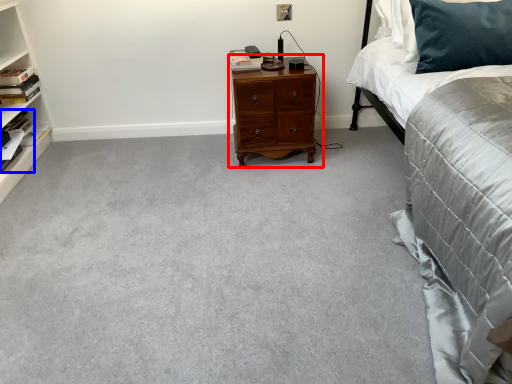
Question: Which of the following is the farthest to the observer, nightstand (highlighted by a red box) or book (highlighted by a blue box)?

Choices:
 (A) nightstand
 (B) book

Answer: (A)